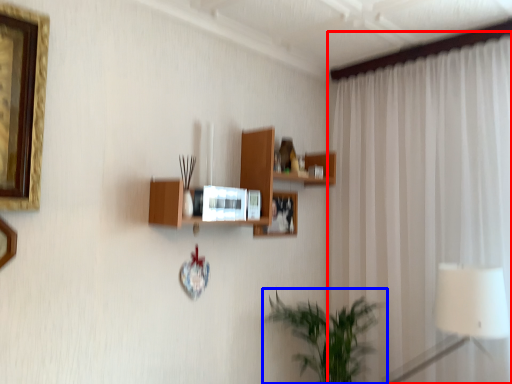
Question: Among these objects, which one is nearest to the camera, curtain (highlighted by a red box) or houseplant (highlighted by a blue box)?

Choices:
 (A) curtain
 (B) houseplant

Answer: (A)